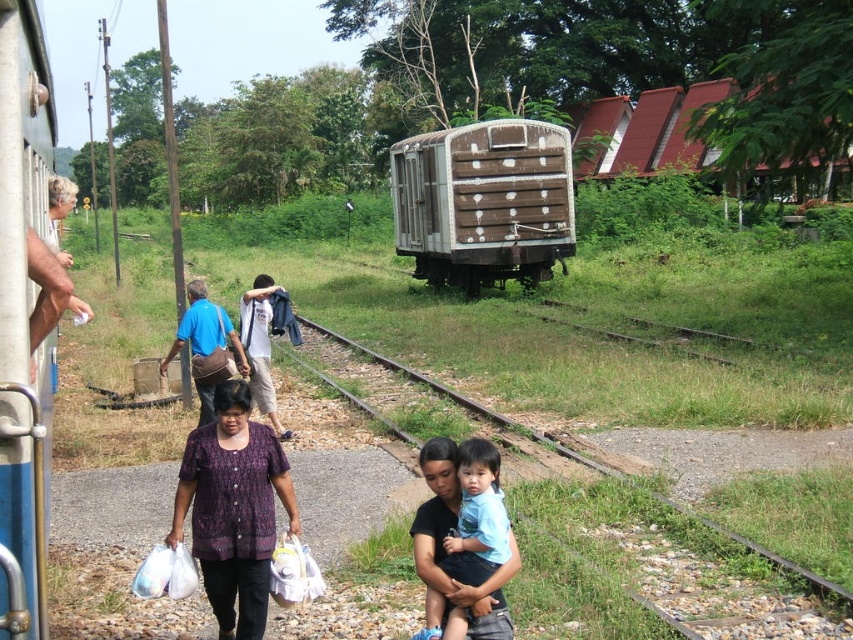
Is blue painted metal train at left below white cotton shirt at center?

No, blue painted metal train at left is not below white cotton shirt at center.

Which of these two, blue painted metal train at left or white cotton shirt at center, stands shorter?

With less height is white cotton shirt at center.

Does point (19, 141) come closer to viewer compared to point (268, 412)?

Yes, it is.

The width and height of the screenshot is (853, 640). What are the coordinates of `blue painted metal train at left` in the screenshot? It's located at (22, 285).

Describe the element at coordinates (22, 285) in the screenshot. I see `blue painted metal train at left` at that location.

Which of these two, blue painted metal train at left or gravel railroad track at center, stands shorter?

gravel railroad track at center is shorter.

Who is more distant from viewer, (1, 198) or (662, 502)?

The point (662, 502) is more distant.

Where is `blue painted metal train at left`? blue painted metal train at left is located at coordinates (22, 285).

Who is shorter, light blue shirt at center or white cotton shirt at center?

light blue shirt at center is shorter.

Does light blue shirt at center have a larger size compared to white cotton shirt at center?

Incorrect, light blue shirt at center is not larger than white cotton shirt at center.

Identify the location of light blue shirt at center. The image size is (853, 640). 462,538.